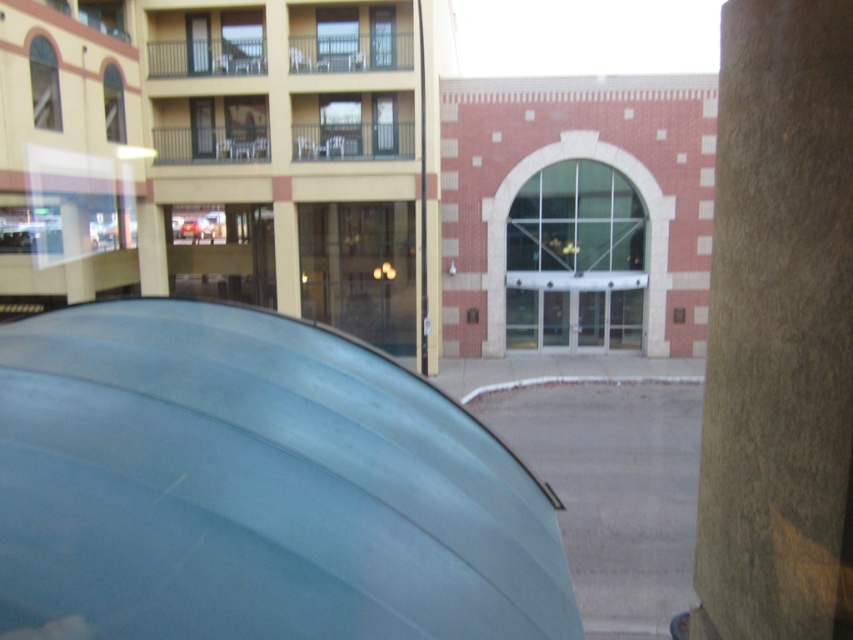
In the scene shown: You are standing at the entrance of the building and want to locate the brown stone pillar at right. According to the coordinates provided, where should you look to find it?

The brown stone pillar at right is located at coordinates point (779,332).

Consider the image. You are a delivery person arriving at the building entrance. You need to park your metallic silver car at center between the brown stone pillar at right and another object. Is the space between them wide enough for your car?

The brown stone pillar at right is larger in size than metallic silver car at center, so there might be sufficient space to park the car between them, but the exact width depends on the distance between the pillar and the other object not mentioned here.

You are a parking attendant who needs to guide a driver to park their car between two existing vehicles. The scene has a matte blue car at center and a metallic silver car at center. Can you determine the correct side to park the new car so it aligns with the existing vehicles?

The matte blue car at center is to the right of the metallic silver car at center, so the new car should be parked to the left of the metallic silver car at center to maintain alignment.